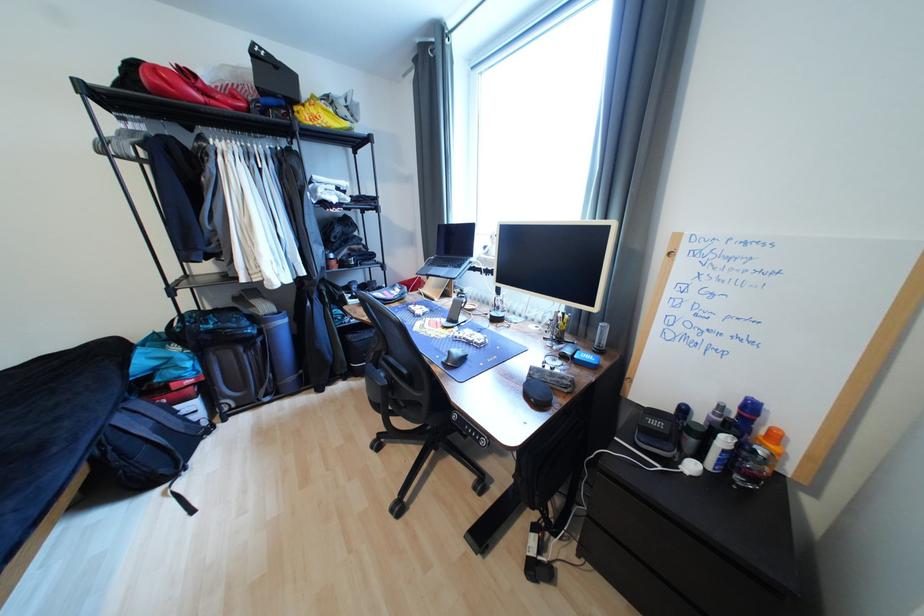
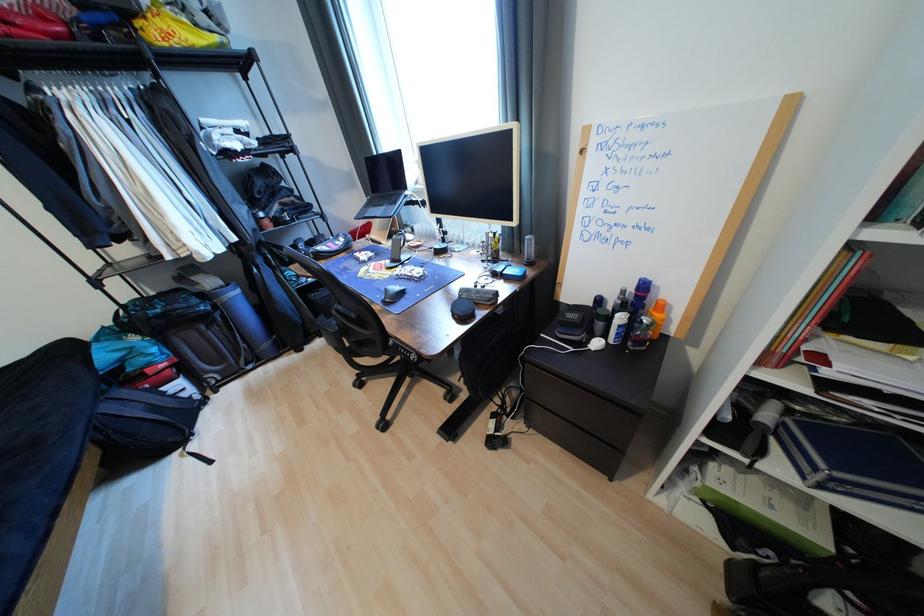
The point at (672, 254) is marked in the first image. Where is the corresponding point in the second image?

(585, 153)